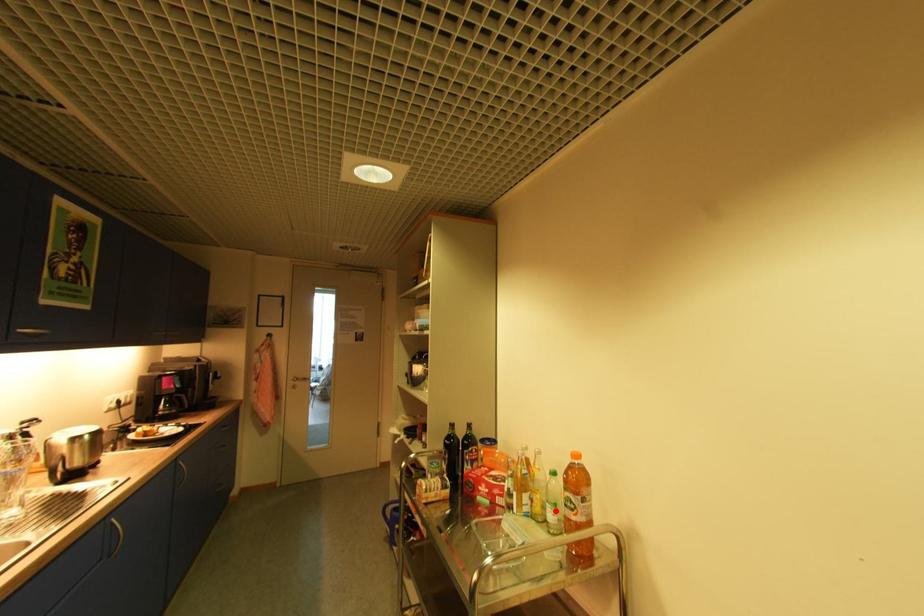
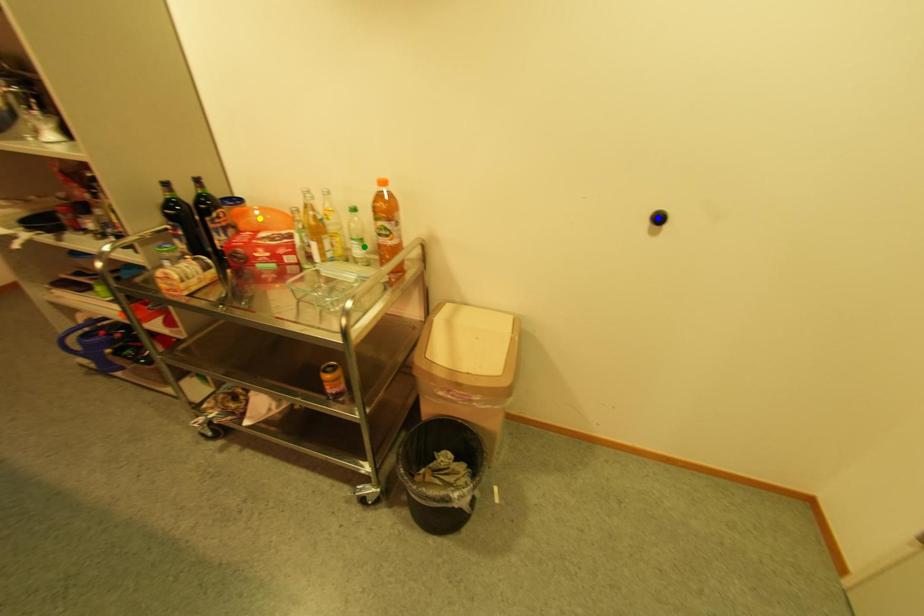
Question: I am providing you with two images of the same scene from different viewpoints. A red point is marked on the first image. You are given multiple points on the second image. Which spot in image 2 lines up with the point in image 1?

Choices:
 (A) yellow point
 (B) blue point
 (C) green point

Answer: (C)